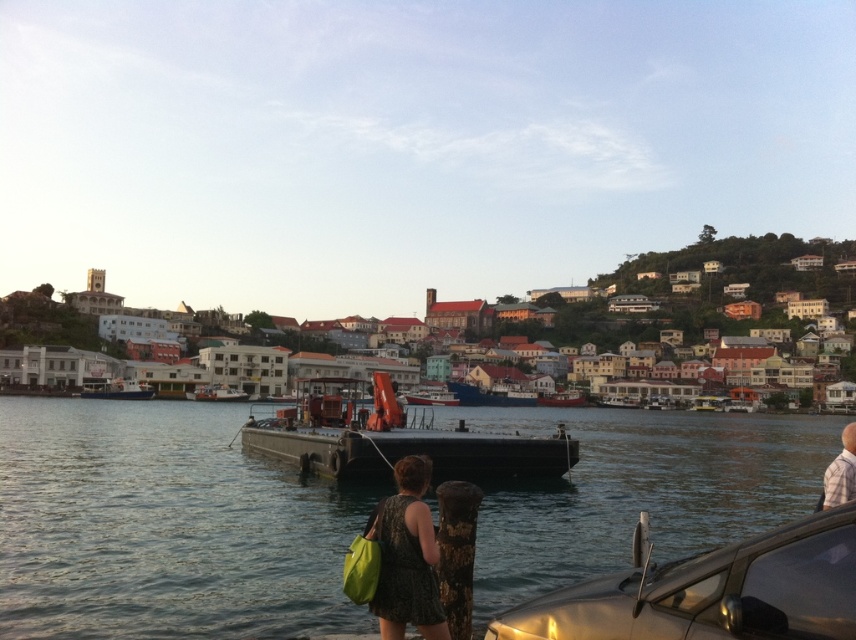
You are standing at the waterfront and want to reach a specific point marked at coordinates point [120,388]. If you have a drone that can fly 150 meters, will it be able to reach that point from your current position?

The distance of point [120,388] from viewer is 125.87 meters, so yes, the drone can reach the point as it is within the 150 meters range.

You are planning to take a photo of the scene with a camera that has a 1.5 meter wide frame. The frame can only capture objects that are within its width. Given that the matte black dress at lower center and the red matte boat at center are both in the frame, will the entire width of the frame be filled by these two objects combined?

The matte black dress at lower center is less wide than the red matte boat at center. Combined, their total width would still depend on their individual widths. However, since the question does not provide exact measurements, we cannot definitively determine if their combined width fills the 1.5 meter frame. The answer requires knowing each object width.

You are standing at the waterfront and see the shiny silver car at lower right and the wooden boat at center. Which object is closer to your left side?

The shiny silver car at lower right is closer to your left side because it is positioned to the left of the wooden boat at center.